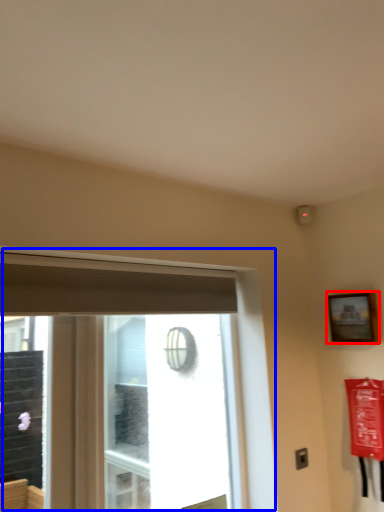
Question: Among these objects, which one is farthest to the camera, picture frame (highlighted by a red box) or window (highlighted by a blue box)?

Choices:
 (A) picture frame
 (B) window

Answer: (A)